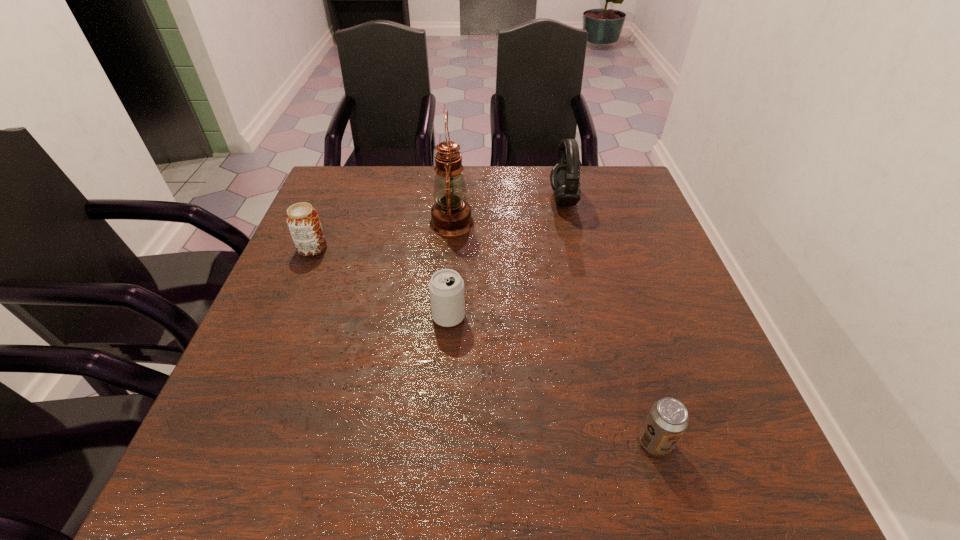
This screenshot has height=540, width=960. In order to click on blank space at the far edge in this screenshot , I will do `click(415, 208)`.

At what (x,y) coordinates should I click in order to perform the action: click on vacant space at the near edge. Please return your answer as a coordinate pair (x, y). This screenshot has width=960, height=540. Looking at the image, I should click on (466, 468).

The image size is (960, 540). In order to click on free region at the left edge of the desktop in this screenshot , I will do `click(292, 343)`.

This screenshot has width=960, height=540. In order to click on vacant space at the right edge in this screenshot , I will do `click(666, 277)`.

In the image, there is a desktop. Where is `free space at the far left corner`? The image size is (960, 540). free space at the far left corner is located at coordinates (322, 211).

Image resolution: width=960 pixels, height=540 pixels. What are the coordinates of `vacant area at the far right corner of the desktop` in the screenshot? It's located at (599, 186).

Where is `vacant area that lies between the tallest object and the headset`? The height and width of the screenshot is (540, 960). vacant area that lies between the tallest object and the headset is located at coordinates (507, 211).

The image size is (960, 540). Find the location of `vacant point located between the tallest object and the headset`. vacant point located between the tallest object and the headset is located at coordinates (507, 211).

Where is `free space that is in between the oil lamp and the nearer beer can`? This screenshot has height=540, width=960. free space that is in between the oil lamp and the nearer beer can is located at coordinates (553, 332).

Find the location of a particular element. Image resolution: width=960 pixels, height=540 pixels. unoccupied area between the farther beer can and the fourth farthest object is located at coordinates (380, 282).